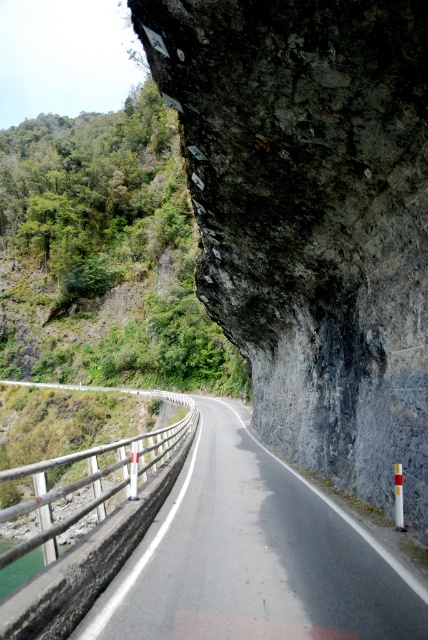
Is point (83, 129) behind point (190, 636)?

Yes, point (83, 129) is farther from viewer.

Who is positioned more to the right, green leafy hillside at upper left or asphalt road at center?

Positioned to the right is asphalt road at center.

This screenshot has height=640, width=428. I want to click on green leafy hillside at upper left, so click(106, 253).

The width and height of the screenshot is (428, 640). I want to click on green leafy hillside at upper left, so click(106, 253).